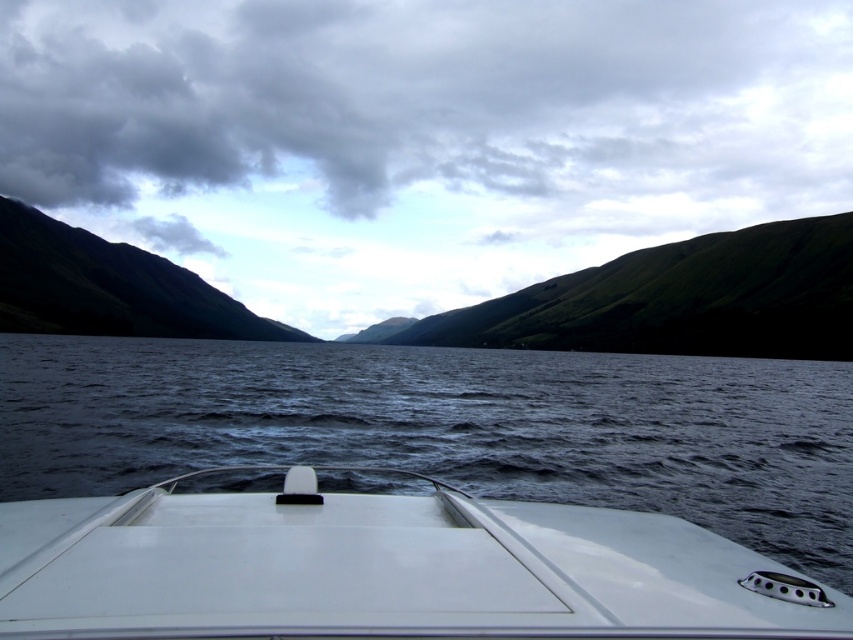
You are standing on the deck of the white glossy boat at center and want to know if you can see the cloudy gray sky at upper center from your current position. Can you see it?

The cloudy gray sky at upper center is much taller than the white glossy boat at center, so yes, you can see the cloudy gray sky at upper center from your position on the boat.

You are standing on the boat and looking towards the horizon. Which of the two green grassy features, the green grassy hill at center or the green grassy mountain at left, appears closer to you?

The green grassy hill at center appears closer to you because it is located below the green grassy mountain at left, indicating it is in a lower position in the visual field, which typically corresponds to being nearer in such scenes.

You are standing on the boat and looking at the cloudy gray sky at upper center and the green grassy hill at center. Which one appears taller from your perspective?

The cloudy gray sky at upper center appears taller than the green grassy hill at center because it has a greater height in the scene.